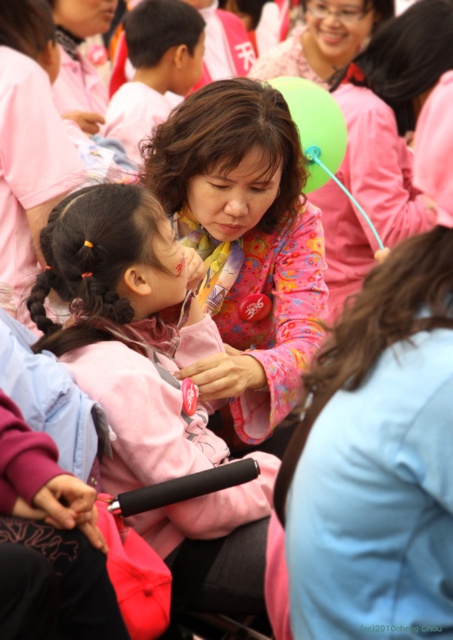
Question: Among these objects, which one is farthest from the camera?

Choices:
 (A) pink fabric at center
 (B) floral fabric blouse at center
 (C) matte pink shirt at upper left

Answer: (C)

Question: Considering the relative positions of floral fabric blouse at center and matte pink shirt at upper left in the image provided, where is floral fabric blouse at center located with respect to matte pink shirt at upper left?

Choices:
 (A) below
 (B) above

Answer: (A)

Question: Based on their relative distances, which object is farther from the matte pink shirt at upper left?

Choices:
 (A) light pink fabric at upper left
 (B) floral fabric blouse at center
 (C) pink fabric at center
 (D) matte pink shirt at upper center

Answer: (B)

Question: Is matte pink blouse at center to the right of light pink fabric at upper left from the viewer's perspective?

Choices:
 (A) no
 (B) yes

Answer: (B)

Question: Which point appears farthest from the camera in this image?

Choices:
 (A) 322,74
 (B) 125,131

Answer: (A)

Question: Does floral fabric blouse at center have a lesser width compared to matte pink shirt at upper center?

Choices:
 (A) yes
 (B) no

Answer: (A)